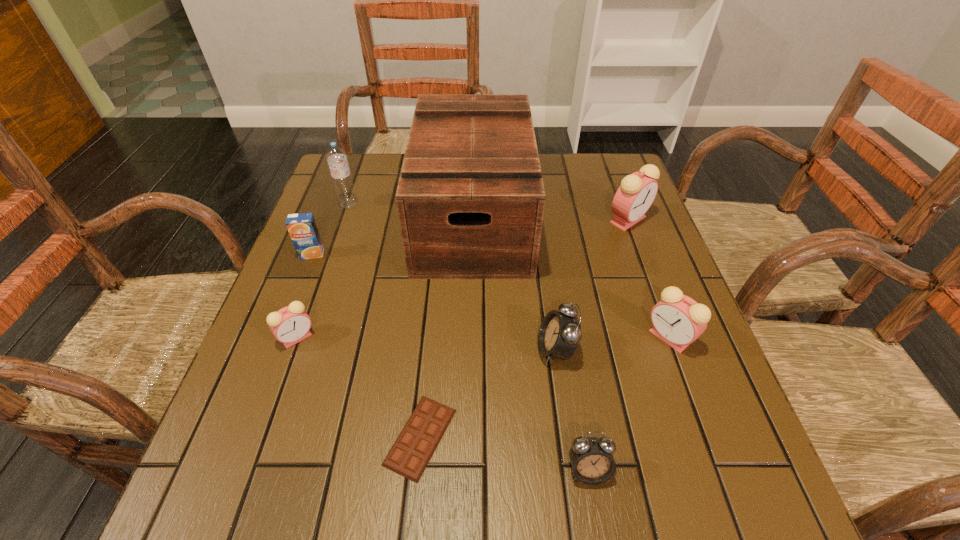
At what (x,y) coordinates should I click in order to perform the action: click on alarm clock that is at the left edge. Please return your answer as a coordinate pair (x, y). This screenshot has width=960, height=540. Looking at the image, I should click on (290, 325).

Where is `object at the far left corner`? object at the far left corner is located at coordinates (337, 160).

Identify the location of free location at the far edge. (545, 165).

Locate an element on the screen. This screenshot has height=540, width=960. free space at the near edge of the desktop is located at coordinates (399, 515).

Identify the location of free location at the left edge of the desktop. This screenshot has height=540, width=960. (354, 208).

The height and width of the screenshot is (540, 960). Find the location of `vacant space at the right edge`. vacant space at the right edge is located at coordinates (658, 426).

Find the location of a particular element. vacant area at the far left corner is located at coordinates (327, 194).

Locate an element on the screen. The image size is (960, 540). vacant region at the far right corner of the desktop is located at coordinates (574, 164).

Identify the location of unoccupied area between the leftmost alarm clock and the farther white alarm clock. (426, 343).

Locate an element on the screen. free area in between the second biggest pink alarm clock and the smallest pink alarm clock is located at coordinates pyautogui.click(x=483, y=338).